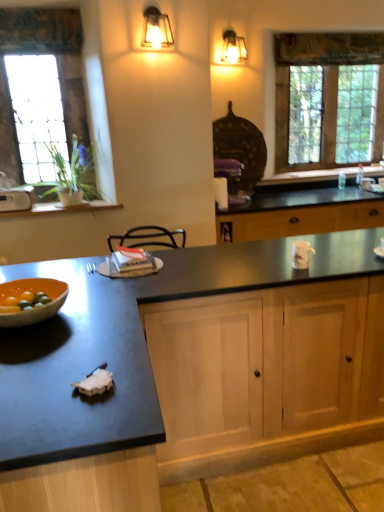
This screenshot has width=384, height=512. Identify the location of vacant space behind white crumbly food at center. coord(99,355).